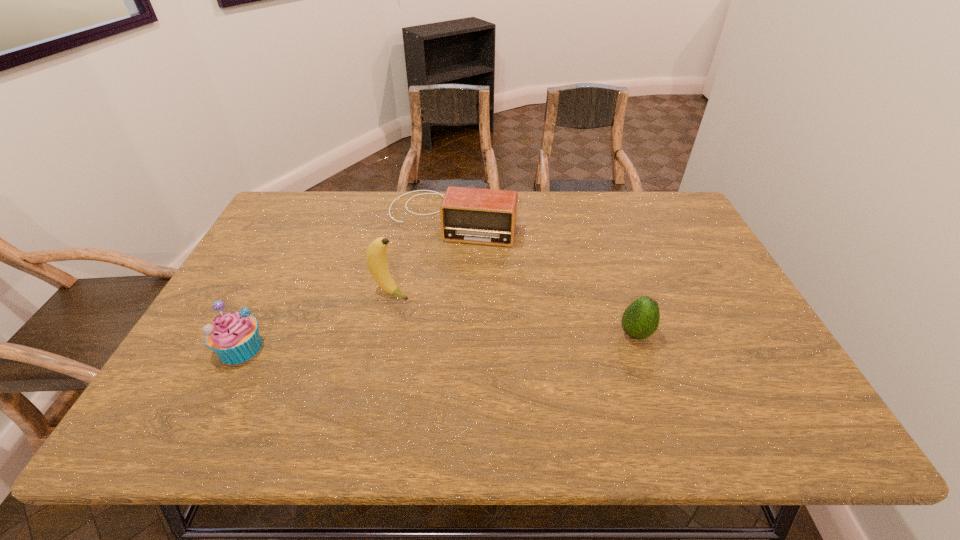
Find the location of a particular element. The height and width of the screenshot is (540, 960). the leftmost object is located at coordinates (234, 337).

You are a GUI agent. You are given a task and a screenshot of the screen. Output one action in this format:
    pyautogui.click(x=<x>, y=<y>)
    Task: Click on the avocado
    
    Given the screenshot: What is the action you would take?
    pyautogui.click(x=640, y=320)

Identify the location of the tallest object. (376, 255).

The image size is (960, 540). I want to click on the third nearest object, so click(x=376, y=255).

At what (x,y) coordinates should I click in order to perform the action: click on radio receiver. Please return your answer as a coordinate pair (x, y). Looking at the image, I should click on (470, 215).

The height and width of the screenshot is (540, 960). Find the location of `free spot located 0.050m on the front of the leftmost object`. free spot located 0.050m on the front of the leftmost object is located at coordinates (221, 386).

You are a GUI agent. You are given a task and a screenshot of the screen. Output one action in this format:
    pyautogui.click(x=<x>, y=<y>)
    Task: Click on the vacant space located on the left of the avocado
    
    Given the screenshot: What is the action you would take?
    pyautogui.click(x=528, y=334)

You are a GUI agent. You are given a task and a screenshot of the screen. Output one action in this format:
    pyautogui.click(x=<x>, y=<y>)
    Task: Click on the free space located 0.140m from the stem of the third nearest object
    
    Given the screenshot: What is the action you would take?
    pyautogui.click(x=450, y=315)

At what (x,y) coordinates should I click in order to perform the action: click on free location located 0.310m from the stem of the third nearest object. Please return your answer as a coordinate pair (x, y). Looking at the image, I should click on (511, 341).

This screenshot has height=540, width=960. I want to click on vacant area situated from the stem of the third nearest object, so click(x=499, y=336).